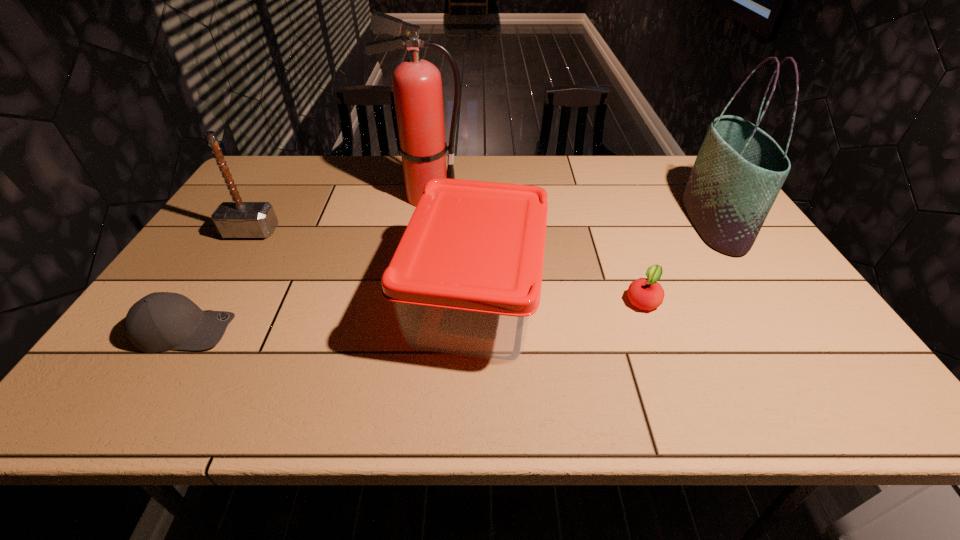
Locate an element on the screen. vacant region located 0.050m on the front of the tray is located at coordinates (473, 397).

The width and height of the screenshot is (960, 540). I want to click on free spot located on the front brim of the fifth tallest object, so click(x=331, y=330).

Find the location of a particular element. free space located 0.330m on the right of the fifth object from left to right is located at coordinates (796, 300).

Where is `object at the far edge`? object at the far edge is located at coordinates (417, 86).

The height and width of the screenshot is (540, 960). In order to click on object that is at the near edge in this screenshot , I will do `click(466, 277)`.

Where is `hammer situated at the left edge`? hammer situated at the left edge is located at coordinates (237, 219).

Where is `baseball cap at the left edge`? baseball cap at the left edge is located at coordinates (160, 321).

Locate an element on the screen. The width and height of the screenshot is (960, 540). object located in the right edge section of the desktop is located at coordinates (739, 171).

This screenshot has height=540, width=960. In order to click on blank area at the far edge in this screenshot , I will do `click(320, 179)`.

The height and width of the screenshot is (540, 960). I want to click on vacant position at the near edge of the desktop, so click(x=434, y=407).